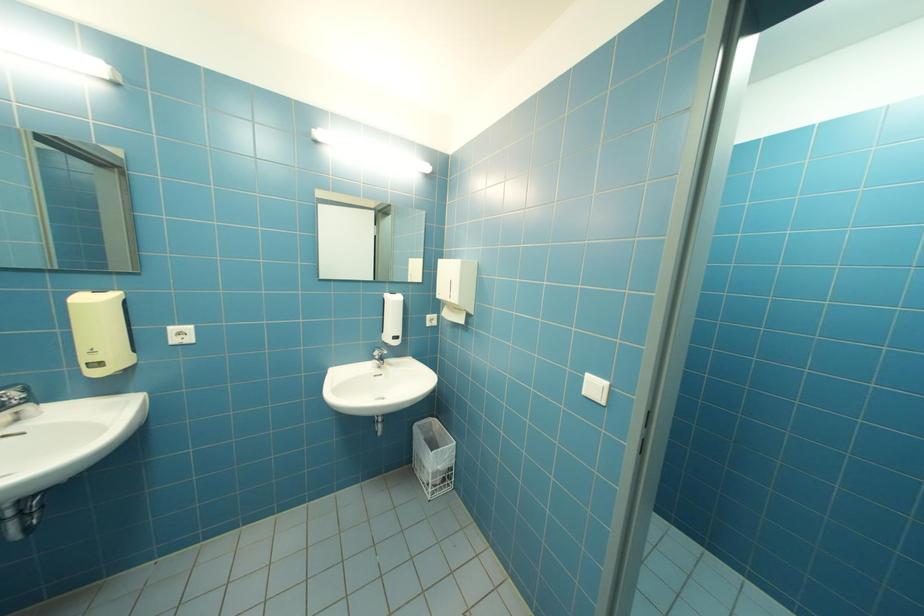
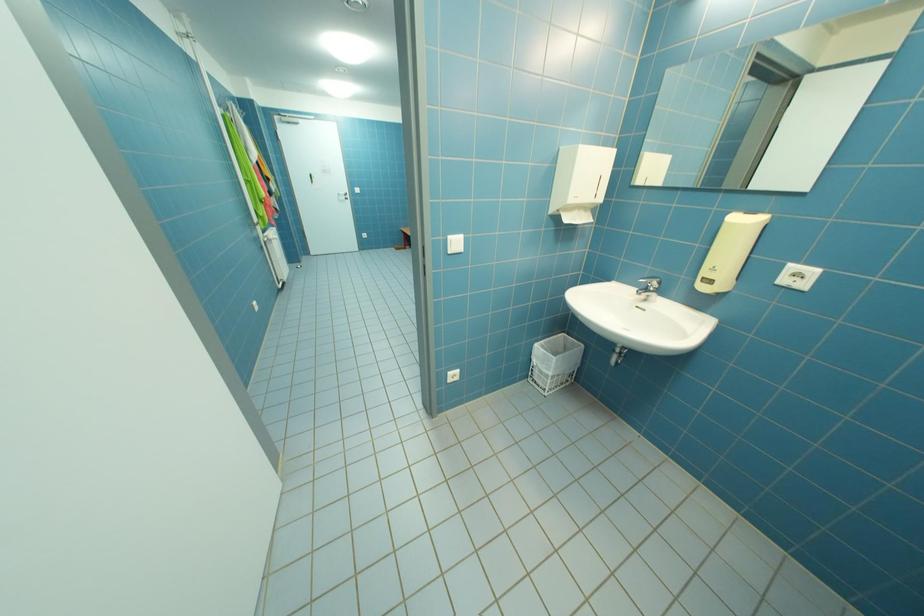
The first image is from the beginning of the video and the second image is from the end. How did the camera likely rotate when shooting the video?

The camera's rotation is toward left-down.